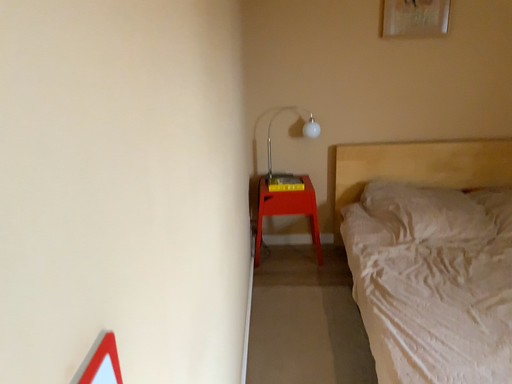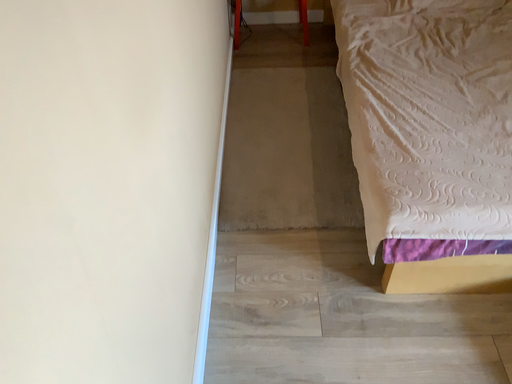
Question: How did the camera likely rotate when shooting the video?

Choices:
 (A) rotated downward
 (B) rotated upward

Answer: (A)